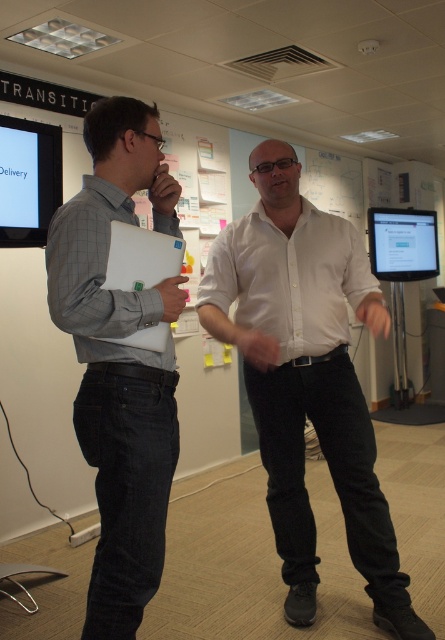
Question: Is white glossy shirt at center to the left of white matte laptop at left from the viewer's perspective?

Choices:
 (A) yes
 (B) no

Answer: (B)

Question: Does white glossy shirt at center have a smaller size compared to gray matte shirt at left?

Choices:
 (A) yes
 (B) no

Answer: (B)

Question: Can you confirm if white glossy shirt at center is wider than gray matte shirt at left?

Choices:
 (A) yes
 (B) no

Answer: (A)

Question: Which point is closer to the camera taking this photo?

Choices:
 (A) (106, 237)
 (B) (125, 275)
 (C) (348, 456)

Answer: (A)

Question: Considering the real-world distances, which object is closest to the gray matte shirt at left?

Choices:
 (A) white glossy shirt at center
 (B) white matte laptop at left

Answer: (B)

Question: Which object appears closest to the camera in this image?

Choices:
 (A) white matte laptop at left
 (B) white glossy shirt at center

Answer: (A)